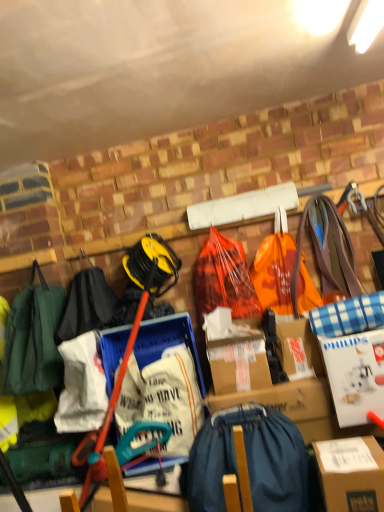
Question: Considering the relative sizes of orange plastic bag at center, marked as the 1th grocery bag in a left-to-right arrangement, and orange plastic grocery bag at center, the 1th grocery bag in the right-to-left sequence, in the image provided, is orange plastic bag at center, marked as the 1th grocery bag in a left-to-right arrangement, thinner than orange plastic grocery bag at center, the 1th grocery bag in the right-to-left sequence,?

Choices:
 (A) yes
 (B) no

Answer: (A)

Question: Is orange plastic bag at center, marked as the 1th grocery bag in a left-to-right arrangement, not close to orange plastic grocery bag at center, placed as the second grocery bag when sorted from left to right?

Choices:
 (A) no
 (B) yes

Answer: (A)

Question: From the image's perspective, does orange plastic bag at center, the 2th grocery bag when ordered from right to left, appear lower than orange plastic grocery bag at center, the 1th grocery bag in the right-to-left sequence?

Choices:
 (A) yes
 (B) no

Answer: (A)

Question: Is orange plastic bag at center, the 2th grocery bag when ordered from right to left, located outside orange plastic grocery bag at center, placed as the second grocery bag when sorted from left to right?

Choices:
 (A) yes
 (B) no

Answer: (A)

Question: Can you confirm if orange plastic bag at center, marked as the 1th grocery bag in a left-to-right arrangement, is wider than orange plastic grocery bag at center, the 1th grocery bag in the right-to-left sequence?

Choices:
 (A) no
 (B) yes

Answer: (A)

Question: Is point (354, 440) closer or farther from the camera than point (357, 408)?

Choices:
 (A) farther
 (B) closer

Answer: (B)

Question: From the image's perspective, is brown cardboard box at lower right above or below white cardboard box at right?

Choices:
 (A) above
 (B) below

Answer: (B)

Question: Is brown cardboard box at lower right inside or outside of white cardboard box at right?

Choices:
 (A) outside
 (B) inside

Answer: (A)

Question: In terms of height, does brown cardboard box at lower right look taller or shorter compared to white cardboard box at right?

Choices:
 (A) short
 (B) tall

Answer: (A)

Question: Does point (288, 242) appear closer or farther from the camera than point (203, 242)?

Choices:
 (A) closer
 (B) farther

Answer: (A)

Question: From a real-world perspective, is orange plastic grocery bag at center, the 1th grocery bag in the right-to-left sequence, positioned above or below orange plastic bag at center, marked as the 1th grocery bag in a left-to-right arrangement?

Choices:
 (A) below
 (B) above

Answer: (B)

Question: From the image's perspective, relative to orange plastic bag at center, marked as the 1th grocery bag in a left-to-right arrangement, is orange plastic grocery bag at center, placed as the second grocery bag when sorted from left to right, above or below?

Choices:
 (A) above
 (B) below

Answer: (A)

Question: Is orange plastic grocery bag at center, the 1th grocery bag in the right-to-left sequence, taller or shorter than orange plastic bag at center, the 2th grocery bag when ordered from right to left?

Choices:
 (A) short
 (B) tall

Answer: (B)

Question: Would you say orange plastic grocery bag at center, the 1th grocery bag in the right-to-left sequence, is inside or outside brown cardboard box at lower right?

Choices:
 (A) outside
 (B) inside

Answer: (A)

Question: In terms of width, does orange plastic grocery bag at center, the 1th grocery bag in the right-to-left sequence, look wider or thinner when compared to brown cardboard box at lower right?

Choices:
 (A) wide
 (B) thin

Answer: (B)